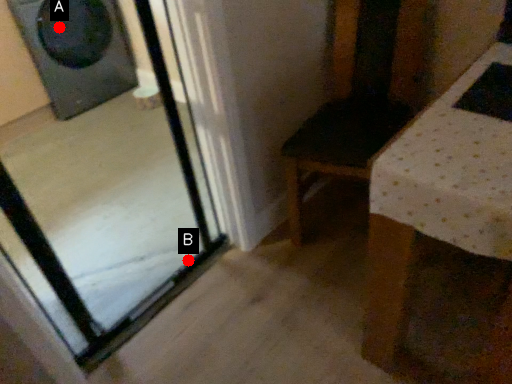
Question: Two points are circled on the image, labeled by A and B beside each circle. Which of the following is the farthest from the observer?

Choices:
 (A) A is further
 (B) B is further

Answer: (A)